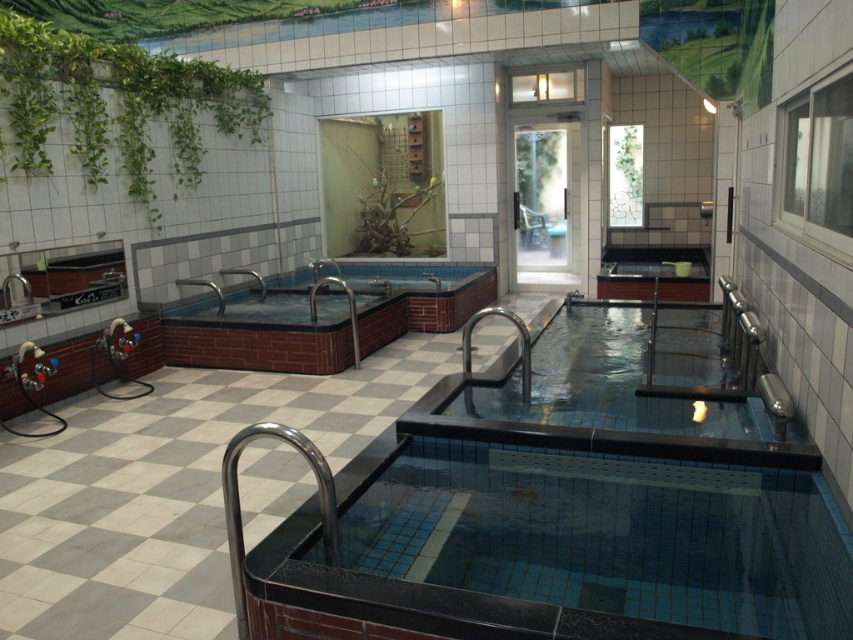
Question: Which object is farther from the camera taking this photo?

Choices:
 (A) green leafy plant at upper center
 (B) green leafy plant at upper left

Answer: (A)

Question: Among these points, which one is farthest from the camera?

Choices:
 (A) (495, 561)
 (B) (236, 332)

Answer: (B)

Question: Does blue ceramic jacuzzi at center appear over green leafy plant at upper center?

Choices:
 (A) yes
 (B) no

Answer: (B)

Question: Which is farther from the blue mosaic tile swimming pool at center?

Choices:
 (A) green leafy plant at upper center
 (B) green leafy plant at upper left
 (C) blue ceramic jacuzzi at center

Answer: (B)

Question: Can you confirm if blue ceramic jacuzzi at center is wider than green leafy plant at upper center?

Choices:
 (A) no
 (B) yes

Answer: (B)

Question: Does blue mosaic tile swimming pool at center have a lesser width compared to green leafy plant at upper center?

Choices:
 (A) yes
 (B) no

Answer: (B)